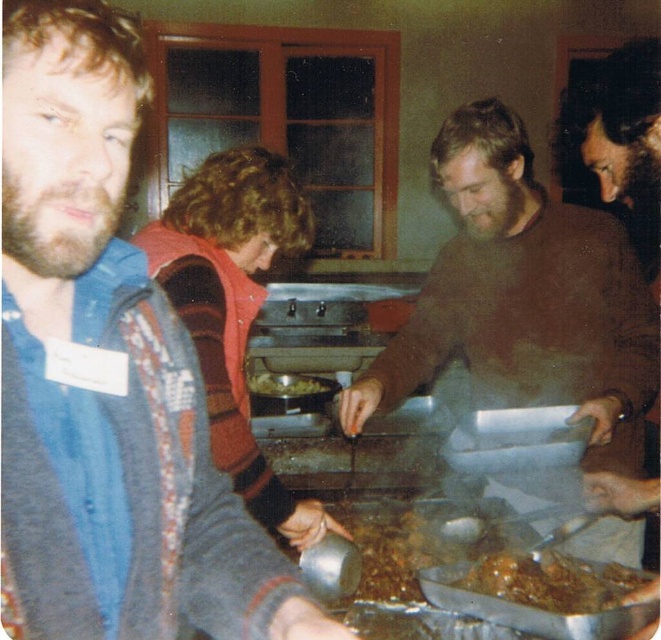
Question: Is brown wool sweater at center above brown matte food at center?

Choices:
 (A) no
 (B) yes

Answer: (B)

Question: Where is brown fuzzy sweater at center located in relation to brown matte food at center in the image?

Choices:
 (A) above
 (B) below

Answer: (A)

Question: Which is nearer to the brown fuzzy sweater at center?

Choices:
 (A) brown matte sweater at center
 (B) brown wool sweater at center
 (C) shiny silver tray at center
 (D) brown matte food at center

Answer: (C)

Question: Observing the image, what is the correct spatial positioning of brown matte sweater at center in reference to shiny silver tray at center?

Choices:
 (A) above
 (B) below

Answer: (A)

Question: Considering the real-world distances, which object is farthest from the brown matte food at center?

Choices:
 (A) brown wool sweater at center
 (B) shiny silver tray at center
 (C) brown matte sweater at center
 (D) brown fuzzy sweater at center

Answer: (D)

Question: Which object appears closest to the camera in this image?

Choices:
 (A) brown fuzzy sweater at center
 (B) shiny silver tray at center
 (C) brown matte food at center

Answer: (C)